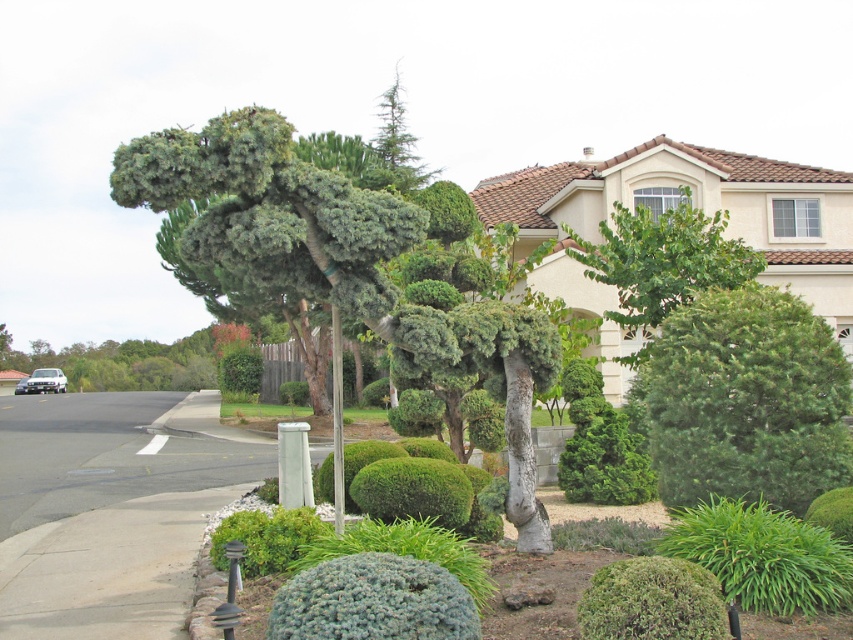
Which is above, green leafy shrub at lower right or green textured bush at center?

green textured bush at center

Identify the location of green leafy shrub at lower right. The image size is (853, 640). (762, 556).

I want to click on green leafy shrub at lower right, so click(x=762, y=556).

Does green textured tree at center appear on the right side of green leafy tree at upper center?

Result: Incorrect, green textured tree at center is not on the right side of green leafy tree at upper center.

Is point (349, 182) farther from camera compared to point (730, 253)?

No, (349, 182) is in front of (730, 253).

This screenshot has width=853, height=640. Identify the location of green textured tree at center. (271, 214).

In the scene shown: Which of these two, green textured tree at center or green textured bush at center, stands taller?

With more height is green textured tree at center.

Locate an element on the screen. This screenshot has width=853, height=640. green textured tree at center is located at coordinates (271, 214).